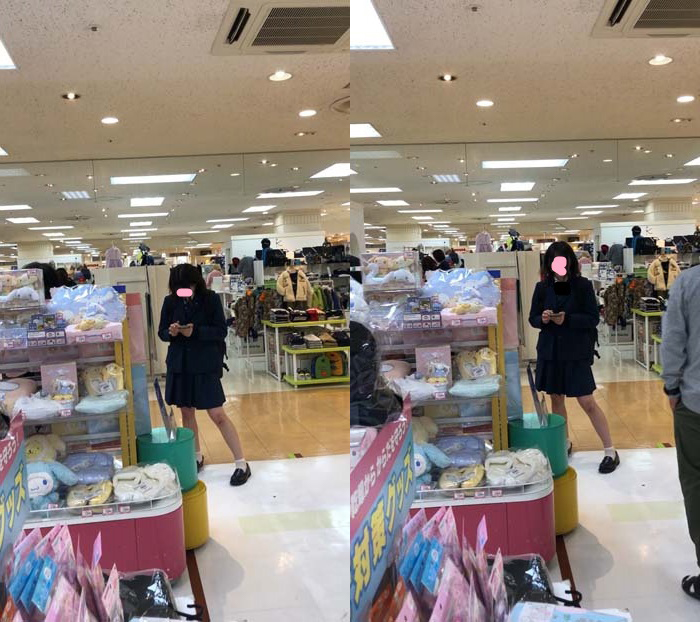
The width and height of the screenshot is (700, 622). I want to click on shoe, so click(x=239, y=475).